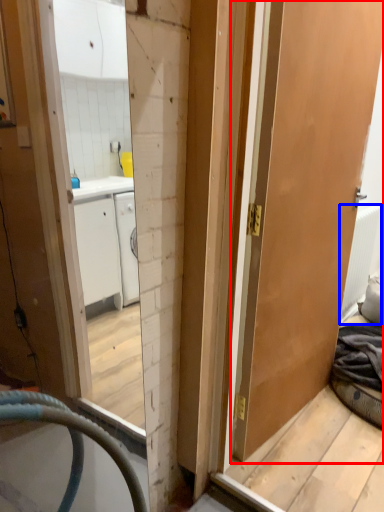
Question: Which object appears farthest to the camera in this image, door (highlighted by a red box) or radiator (highlighted by a blue box)?

Choices:
 (A) door
 (B) radiator

Answer: (B)